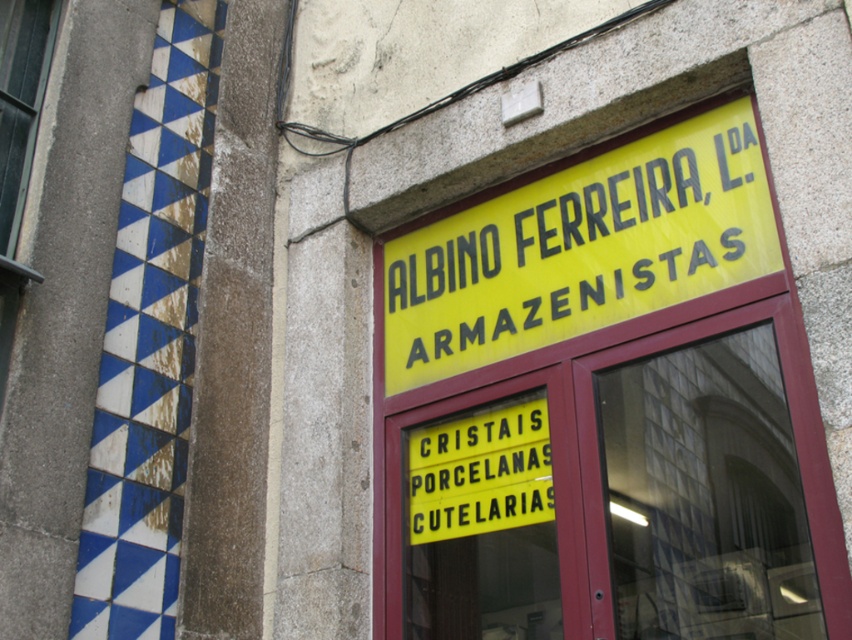
You are a customer looking at the storefront. You notice the yellow plastic sign at upper center and the clear glass window at upper left. Which object is positioned higher up on the building?

The clear glass window at upper left is positioned higher up because the yellow plastic sign at upper center is located below it.

You are standing outside the store and want to read the yellow plastic sign at center. Which side of the clear glass window at upper left should you look towards to see it?

The yellow plastic sign at center is to the right of the clear glass window at upper left, so you should look towards the right side of the clear glass window at upper left to see it.

You are a customer standing in front of the store entrance. You want to read both the yellow plastic sign at upper center and the yellow plastic sign at center. Which sign should you look at first to see the store name?

The yellow plastic sign at upper center has a larger width than the yellow plastic sign at center, so you should look at the yellow plastic sign at upper center first to see the store name.